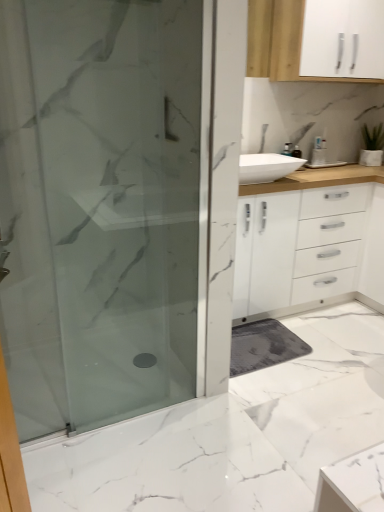
Question: Considering the relative positions of white matte cabinet at upper right and frosted glass shower door at left in the image provided, is white matte cabinet at upper right behind frosted glass shower door at left?

Choices:
 (A) yes
 (B) no

Answer: (A)

Question: Could you tell me if white matte cabinet at upper right is facing frosted glass shower door at left?

Choices:
 (A) yes
 (B) no

Answer: (B)

Question: Is white matte cabinet at upper right wider than frosted glass shower door at left?

Choices:
 (A) yes
 (B) no

Answer: (A)

Question: From the image's perspective, is white matte cabinet at upper right under frosted glass shower door at left?

Choices:
 (A) no
 (B) yes

Answer: (A)

Question: Can you confirm if white matte cabinet at upper right is taller than frosted glass shower door at left?

Choices:
 (A) yes
 (B) no

Answer: (B)

Question: Is white matte cabinet at upper right smaller than frosted glass shower door at left?

Choices:
 (A) no
 (B) yes

Answer: (A)

Question: Is frosted glass shower door at left located outside white matte cabinet at upper right?

Choices:
 (A) yes
 (B) no

Answer: (A)

Question: Is the position of frosted glass shower door at left less distant than that of white matte cabinet at upper right?

Choices:
 (A) no
 (B) yes

Answer: (B)

Question: Can you confirm if frosted glass shower door at left is positioned to the left of white matte cabinet at upper right?

Choices:
 (A) no
 (B) yes

Answer: (B)

Question: Could you tell me if frosted glass shower door at left is turned towards white matte cabinet at upper right?

Choices:
 (A) no
 (B) yes

Answer: (A)

Question: Is frosted glass shower door at left surrounding white matte cabinet at upper right?

Choices:
 (A) yes
 (B) no

Answer: (B)

Question: Can you confirm if frosted glass shower door at left is shorter than white matte cabinet at upper right?

Choices:
 (A) no
 (B) yes

Answer: (A)

Question: Visually, is white matte cabinet at upper right positioned to the left or to the right of frosted glass shower door at left?

Choices:
 (A) right
 (B) left

Answer: (A)